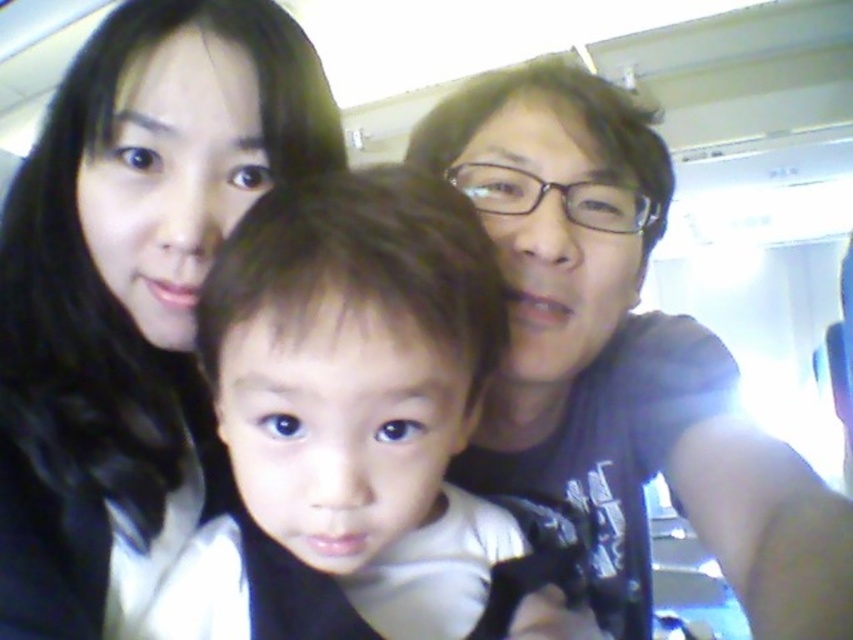
In the scene shown: You are a photographer trying to adjust the lighting for a family photo. You notice the black hair at upper left and the matte black shirt at upper right. Which of these two items is positioned more to the left side of the image?

The black hair at upper left is positioned to the left of the matte black shirt at upper right, so the black hair at upper left is more to the left.

You are a photographer trying to focus on the smooth white shirt at center and the black hair at upper left in this family selfie. Which object should you adjust your camera focus on first to ensure both are in focus?

You should focus on the black hair at upper left first because it is closer to the viewer than the smooth white shirt at center. By focusing on the closer object, the farther one may still be in focus due to depth of field, but focusing on the farther one might leave the closer one blurry.